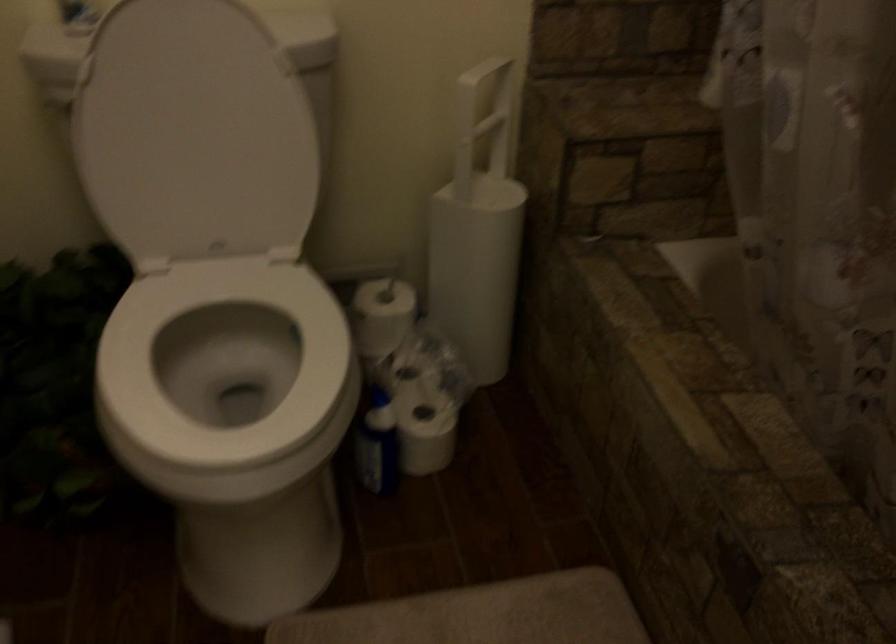
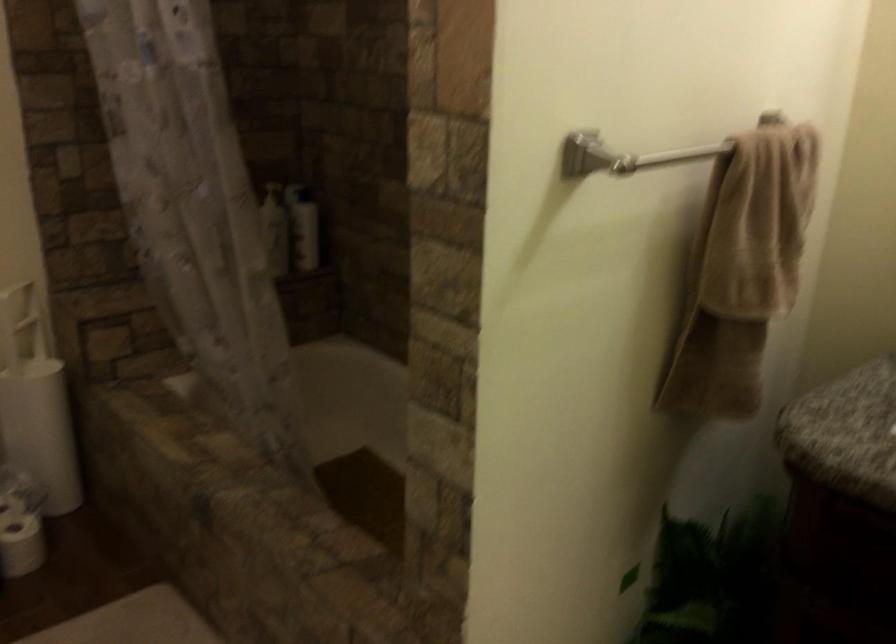
In the second image, find the point that corresponds to pixel 478 129 in the first image.

(20, 323)